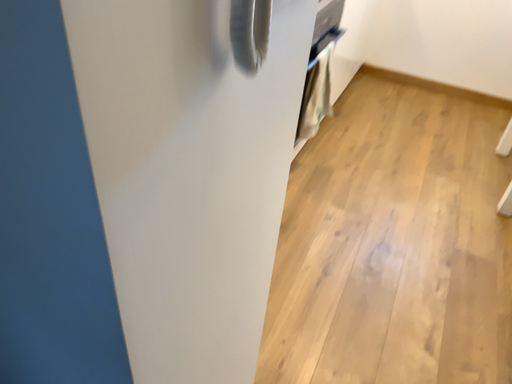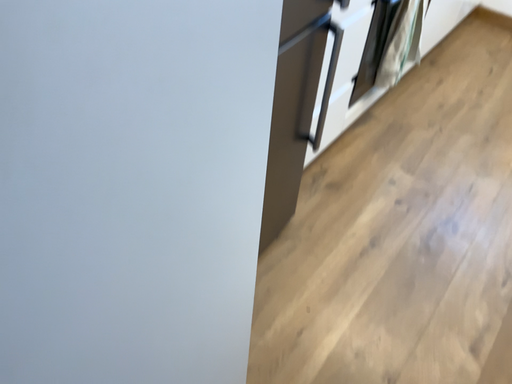
Question: How did the camera likely rotate when shooting the video?

Choices:
 (A) rotated downward
 (B) rotated upward

Answer: (A)